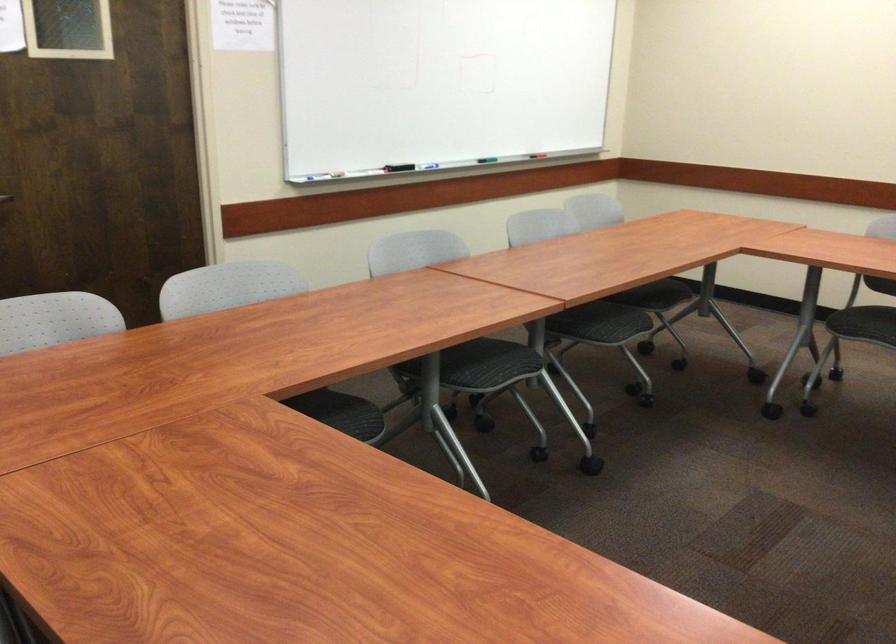
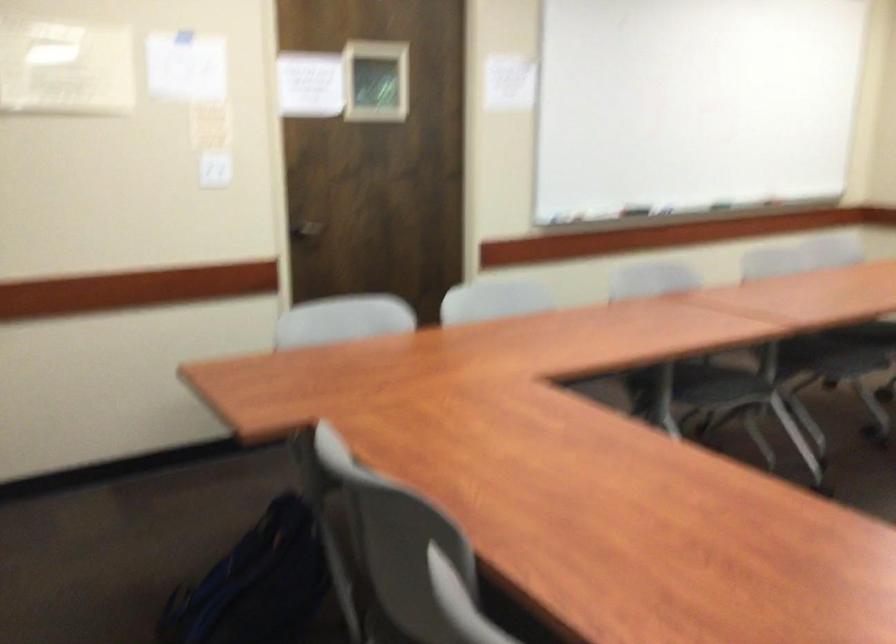
Question: The camera is either moving clockwise (left) or counter-clockwise (right) around the object. The first image is from the beginning of the video and the second image is from the end. Is the camera moving left or right when shooting the video?

Choices:
 (A) Left
 (B) Right

Answer: (B)